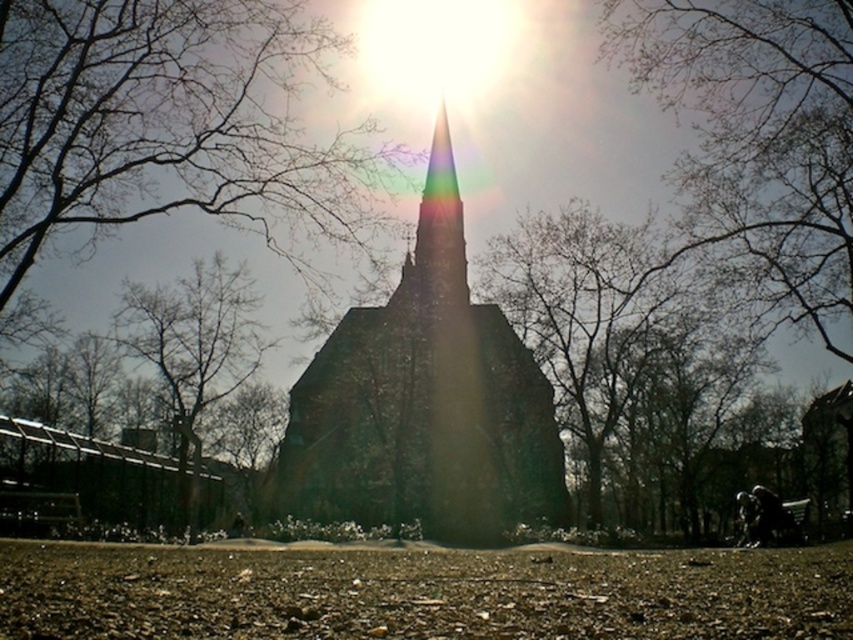
Question: Which object appears farthest from the camera in this image?

Choices:
 (A) green leafy tree at center
 (B) bare branches at upper center
 (C) dark stone church at center
 (D) bare branches at center

Answer: (C)

Question: Can you confirm if bare branches at upper center is positioned above green leafy tree at center?

Choices:
 (A) no
 (B) yes

Answer: (B)

Question: Does bare branches at upper center appear under green leafy tree at center?

Choices:
 (A) yes
 (B) no

Answer: (B)

Question: Is dark stone church at center above green leafy tree at center?

Choices:
 (A) yes
 (B) no

Answer: (A)

Question: Which point is farther to the camera?

Choices:
 (A) bare branches at upper center
 (B) bare branches at center
 (C) dark stone church at center

Answer: (C)

Question: Estimate the real-world distances between objects in this image. Which object is closer to the bare branches at upper center?

Choices:
 (A) dark stone church at center
 (B) green leafy tree at center
 (C) bare branches at center

Answer: (B)